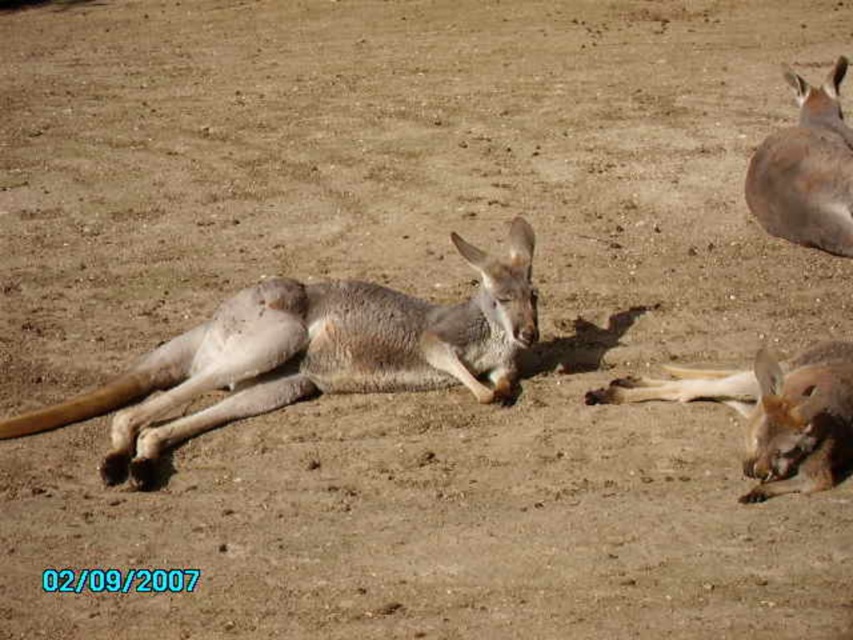
Question: Which point appears closest to the camera in this image?

Choices:
 (A) (310, 372)
 (B) (838, 220)
 (C) (659, 397)

Answer: (C)

Question: Can you confirm if light brown fur at lower right is thinner than light brown fur at upper right?

Choices:
 (A) no
 (B) yes

Answer: (A)

Question: Based on their relative distances, which object is nearer to the light brown fur at lower right?

Choices:
 (A) light brown fur kangaroo at center
 (B) light brown fur at upper right

Answer: (A)

Question: Which object is the closest to the light brown fur kangaroo at center?

Choices:
 (A) light brown fur at upper right
 (B) light brown fur at lower right

Answer: (B)

Question: Is light brown fur kangaroo at center wider than light brown fur at lower right?

Choices:
 (A) no
 (B) yes

Answer: (B)

Question: Does light brown fur at lower right have a smaller size compared to light brown fur at upper right?

Choices:
 (A) no
 (B) yes

Answer: (B)